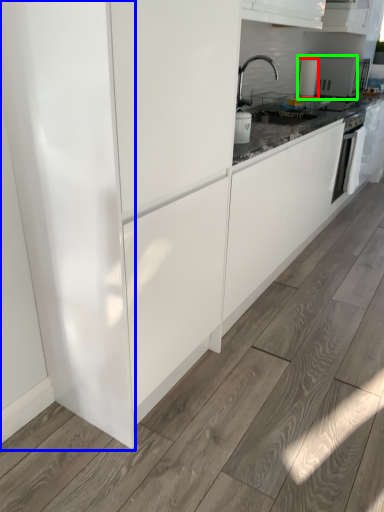
Question: Which is nearer to the kitchen appliance (highlighted by a red box)? glass door (highlighted by a blue box) or appliance (highlighted by a green box).

Choices:
 (A) glass door
 (B) appliance

Answer: (B)